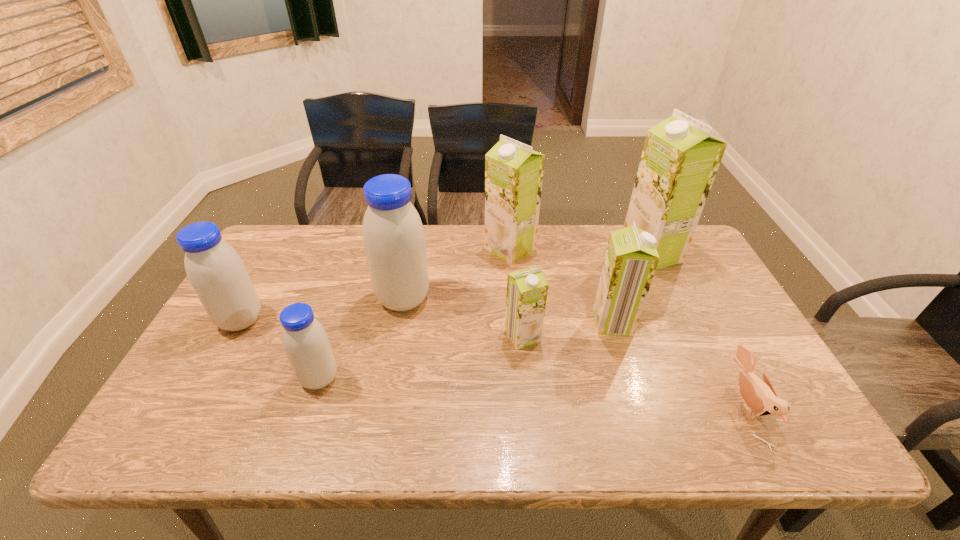
Identify the location of free space located 0.070m at the beak of the shortest object. Image resolution: width=960 pixels, height=540 pixels. (703, 406).

Locate an element on the screen. This screenshot has height=540, width=960. vacant region located 0.300m at the beak of the shortest object is located at coordinates (602, 406).

Where is `vacant point located 0.150m at the beak of the shortest object`? This screenshot has height=540, width=960. vacant point located 0.150m at the beak of the shortest object is located at coordinates (667, 406).

This screenshot has width=960, height=540. What are the coordinates of `object present at the near edge` in the screenshot? It's located at (760, 397).

Find the location of a particular element. The image size is (960, 540). object at the left edge is located at coordinates (215, 270).

You are a GUI agent. You are given a task and a screenshot of the screen. Output one action in this format:
    pyautogui.click(x=<x>, y=<y>)
    Task: Click on the soya milk that is at the right edge
    
    Given the screenshot: What is the action you would take?
    (x=680, y=158)

Where is `bird that is at the right edge`? This screenshot has width=960, height=540. bird that is at the right edge is located at coordinates (760, 397).

Identify the location of object present at the far right corner. (680, 158).

This screenshot has height=540, width=960. In order to click on object that is positioned at the near right corner in this screenshot , I will do `click(760, 397)`.

Find the location of `free space at the far edge`. free space at the far edge is located at coordinates (323, 237).